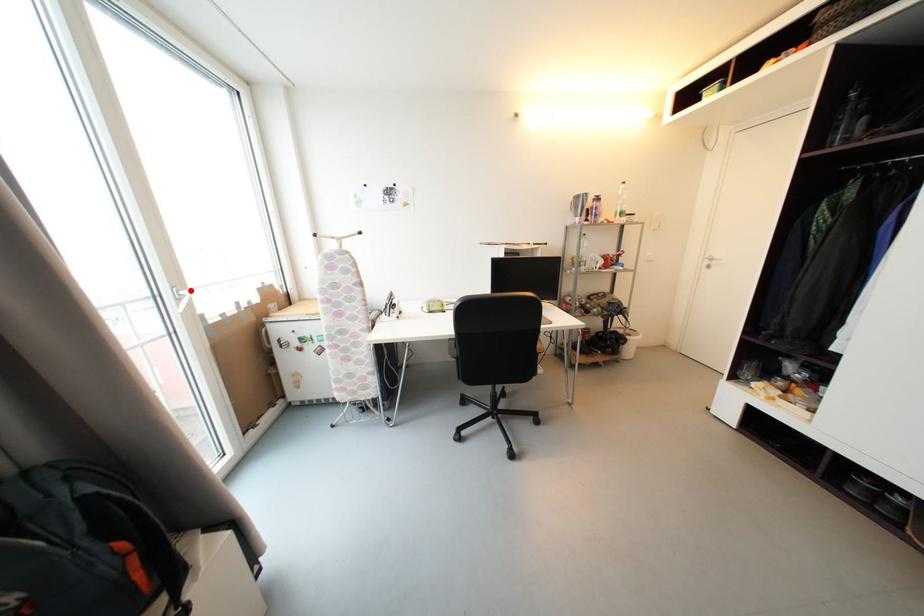
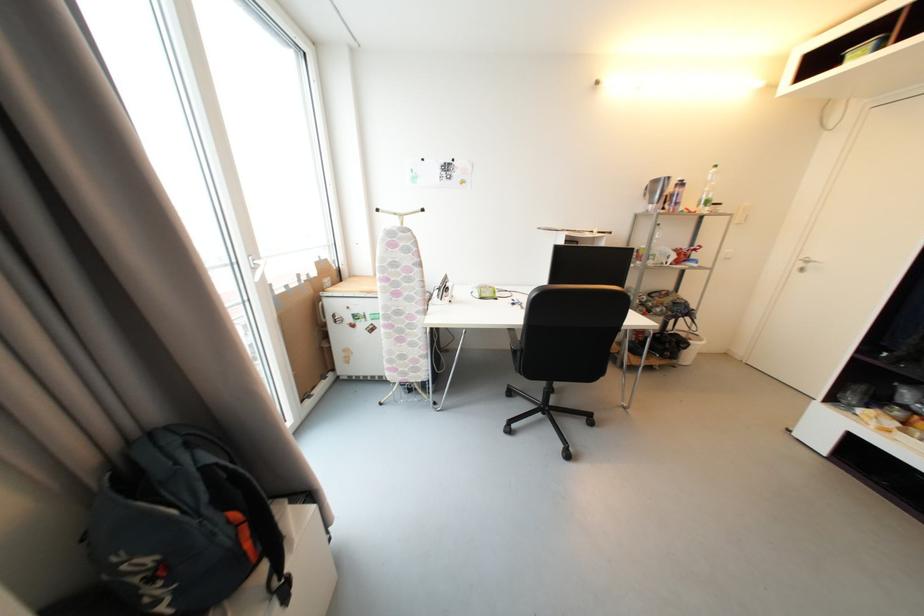
Locate, in the second image, the point that corresponds to the highlighted location in the first image.

(264, 260)